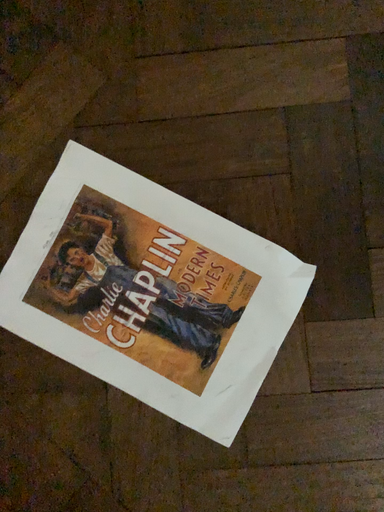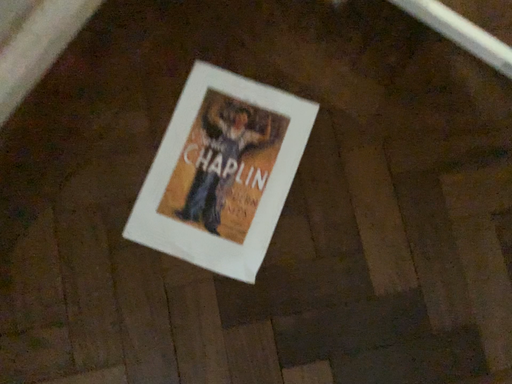
Question: How did the camera likely rotate when shooting the video?

Choices:
 (A) rotated upward
 (B) rotated downward

Answer: (A)